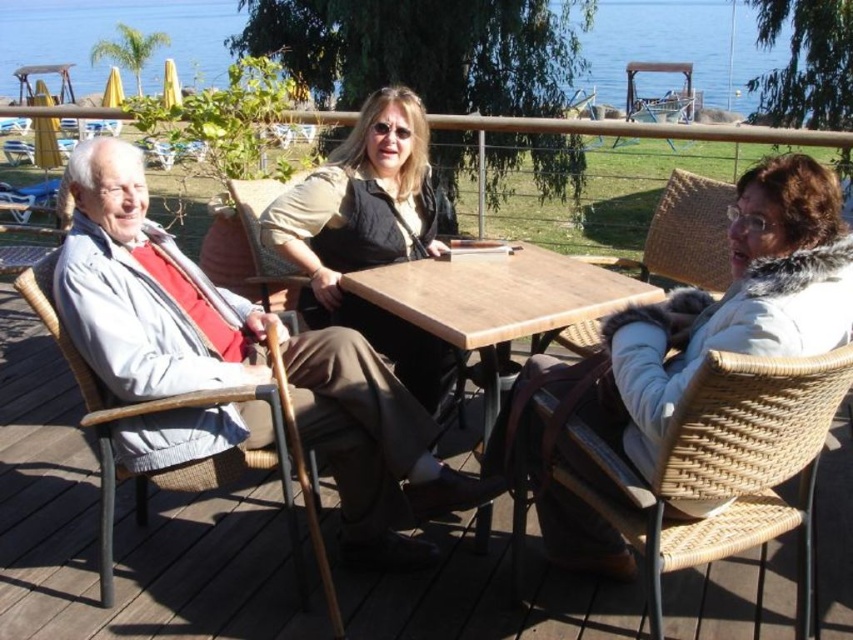
You are standing at the origin point of the coordinate system. You want to move towards the point labeled as point (190, 460). What object will you encounter when you reach that point?

The point (190, 460) corresponds to the woven wicker chair at left, so you will encounter the woven wicker chair at left when you reach that point.

You are a guest at this outdoor table and need to choose a chair to sit in. You prefer a chair that is taller. Which chair should you choose between the woven wicker chair at left and the woven rattan chair at center?

The woven wicker chair at left is taller than the woven rattan chair at center, so you should choose the woven wicker chair at left.

You are a photographer planning to take a portrait of the woman wearing the matte beige vest at center. To ensure the woven wicker chair at left is not distracting in the background, should you move the vest or the chair?

The matte beige vest at center is positioned over the woven wicker chair at left, so moving the vest away from the chair would prevent it from overlapping and ensure the chair is not distracting in the background.